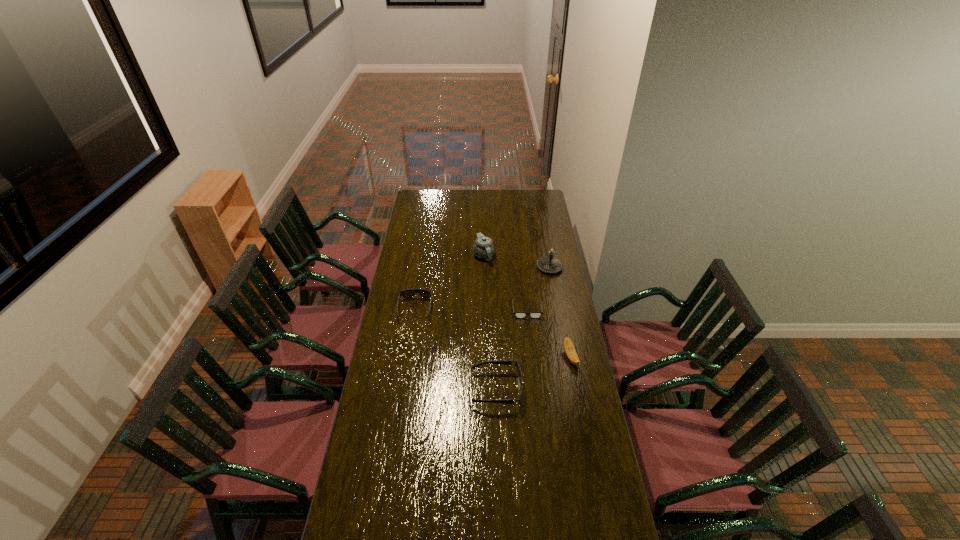
This screenshot has width=960, height=540. Identify the location of vacant space situated 0.350m on the front-facing side of the taller sunglasses. (388, 389).

Image resolution: width=960 pixels, height=540 pixels. In order to click on free space located 0.370m on the front-facing side of the taller sunglasses in this screenshot , I will do click(383, 389).

Locate an element on the screen. vacant position located from the spout of the chinaware is located at coordinates (485, 299).

This screenshot has height=540, width=960. Find the location of `vacant area located on the left of the banana`. vacant area located on the left of the banana is located at coordinates (523, 357).

Locate an element on the screen. This screenshot has width=960, height=540. free space located on the front of the candle is located at coordinates (553, 283).

At what (x,y) coordinates should I click in order to perform the action: click on vacant point located 0.300m on the front-facing side of the spectacles. Please return your answer as a coordinate pair (x, y). The image size is (960, 540). Looking at the image, I should click on (534, 369).

The image size is (960, 540). I want to click on object at the left edge, so click(x=409, y=293).

Locate an element on the screen. This screenshot has height=540, width=960. banana present at the right edge is located at coordinates (569, 348).

This screenshot has width=960, height=540. I want to click on candle that is at the right edge, so (x=550, y=264).

The width and height of the screenshot is (960, 540). What are the coordinates of `spectacles that is positioned at the right edge` in the screenshot? It's located at (517, 314).